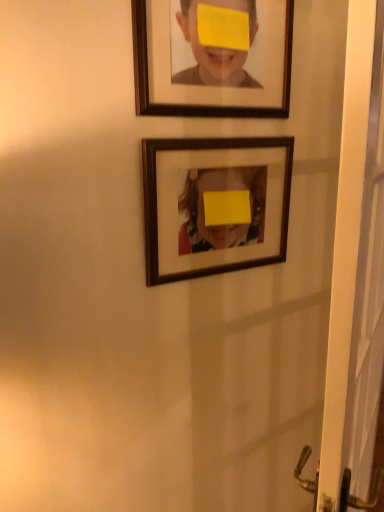
Question: From the image's perspective, is white plastic screen door at right positioned above or below wooden frame at center, the second picture frame from the top?

Choices:
 (A) above
 (B) below

Answer: (B)

Question: Is white plastic screen door at right bigger or smaller than wooden frame at center, which is counted as the 1th picture frame, starting from the bottom?

Choices:
 (A) big
 (B) small

Answer: (A)

Question: Based on their relative distances, which object is nearer to the white plastic screen door at right?

Choices:
 (A) wooden frame at center, the second picture frame from the top
 (B) wooden frame at upper center, positioned as the first picture frame in top-to-bottom order

Answer: (A)

Question: Which is farther from the white plastic screen door at right?

Choices:
 (A) wooden frame at center, which is counted as the 1th picture frame, starting from the bottom
 (B) wooden frame at upper center, positioned as the first picture frame in top-to-bottom order

Answer: (B)